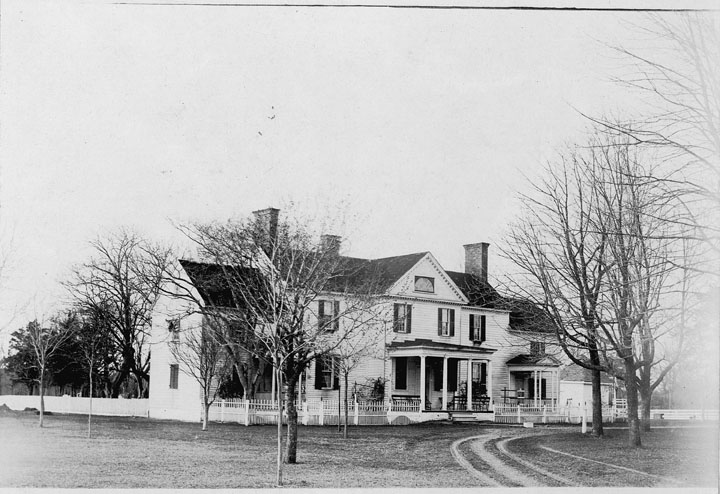
I want to click on white support pole, so click(418, 390), click(443, 389), click(467, 386), click(487, 385), click(534, 390), click(540, 387), click(551, 386), click(557, 384).